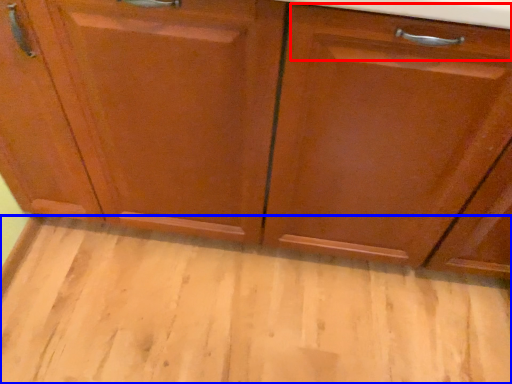
Question: Which of the following is the farthest to the observer, drawer (highlighted by a red box) or plain (highlighted by a blue box)?

Choices:
 (A) drawer
 (B) plain

Answer: (B)